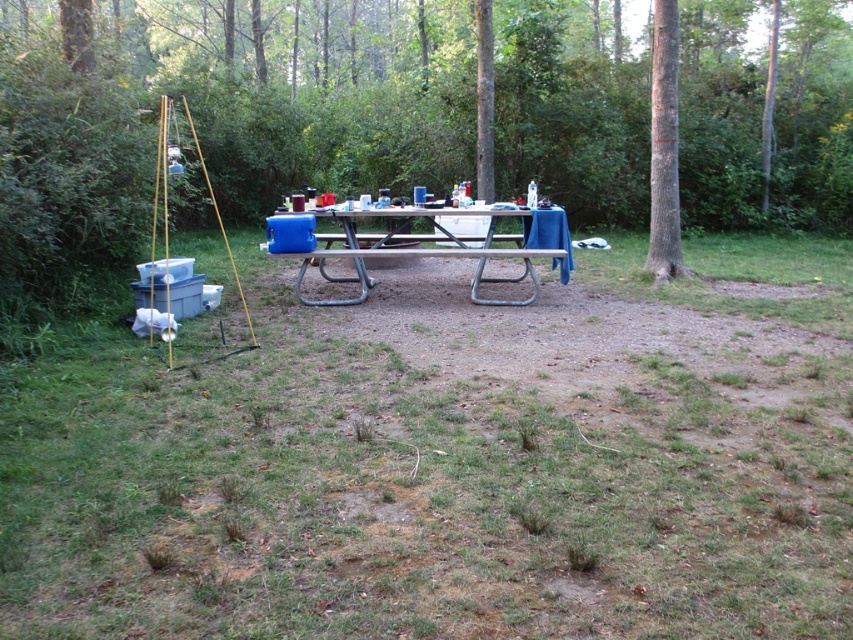
You are planning to set up a tent in the wooded campsite. The white plastic table at center is in your way. To avoid it, which direction should you move relative to the table?

The white plastic table at center is located at point [442,246]. Since the table is at the center, you should move either to the left or right to avoid it.

You are a camper setting up your tent and need to place it so it stays in the shade provided by the trees. The white plastic table at center and the smooth gray bark at right are both under the trees. Which object should you position your tent closer to if you want it to stay shaded all day?

The white plastic table at center is to the left of smooth gray bark at right. Since both are under the trees, positioning the tent closer to either would keep it shaded. However, if you want to ensure it stays shaded all day, consider the position relative to the sun. If the sun moves from east to west, placing the tent closer to the smooth gray bark at right might keep it shaded longer as the afternoon progresses.

You are setting up a campsite and need to place a tent. You have a white plastic table at center and a smooth gray bark at right. Which object is a better indicator of where shade will be available later in the day?

The smooth gray bark at right is a better indicator of where shade will be available later in the day because the white plastic table at center is positioned under it, suggesting that the tree provides shade over the table.